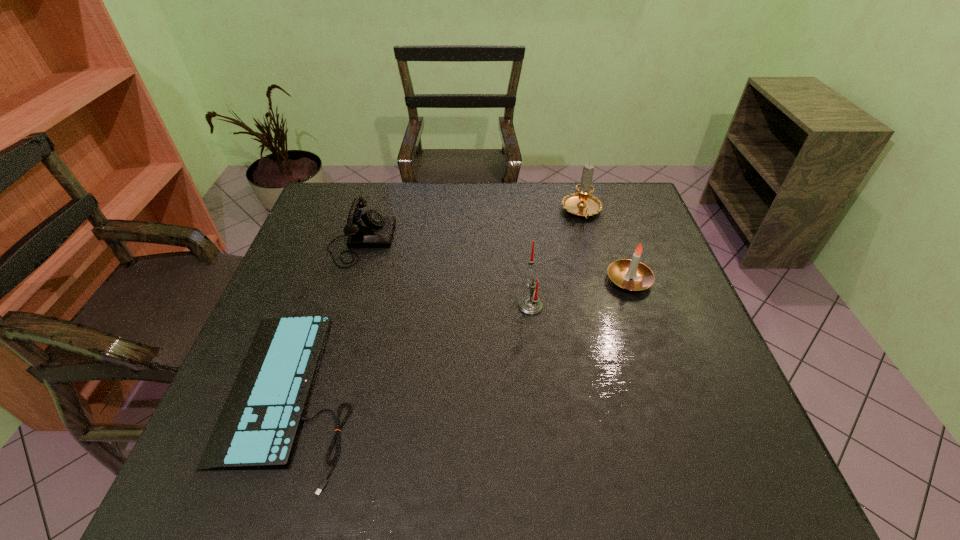
Where is `free spot between the leftmost candle and the fourth tallest object`? The height and width of the screenshot is (540, 960). free spot between the leftmost candle and the fourth tallest object is located at coordinates (445, 273).

This screenshot has height=540, width=960. I want to click on free spot between the third object from right to left and the second shortest object, so click(445, 273).

The width and height of the screenshot is (960, 540). What are the coordinates of `free space between the telephone and the third object from right to left` in the screenshot? It's located at click(x=445, y=273).

What are the coordinates of `free space between the third shortest object and the telephone` in the screenshot? It's located at (495, 260).

This screenshot has width=960, height=540. What are the coordinates of `free space between the third object from right to left and the shortest object` in the screenshot? It's located at (411, 350).

The image size is (960, 540). I want to click on the fourth closest object to the leftmost candle, so click(369, 229).

Find the location of a particular element. Image resolution: width=960 pixels, height=540 pixels. object that stands as the third closest to the farthest candle is located at coordinates coord(369,229).

Locate an element on the screen. The width and height of the screenshot is (960, 540). candle that can be found as the closest to the third object from left to right is located at coordinates (621, 272).

Identify which candle is the nearest to the shortest object. Please provide its 2D coordinates. Your answer should be formatted as a tuple, i.e. [(x, y)], where the tuple contains the x and y coordinates of a point satisfying the conditions above.

[(531, 305)]

Identify the location of free spot that satisfies the following two spatial constraints: 1. on the front face of the third tallest object; 2. on the left side of the telephone. (349, 280).